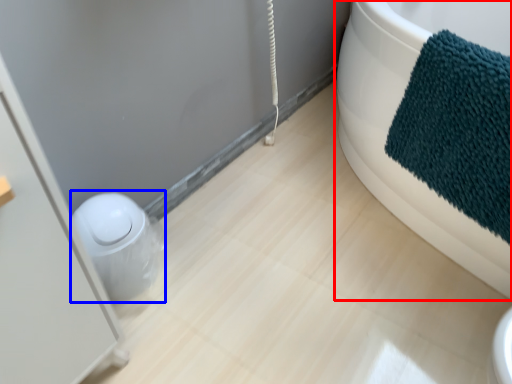
Question: Which object is further to the camera taking this photo, bathtub (highlighted by a red box) or toilet bowl (highlighted by a blue box)?

Choices:
 (A) bathtub
 (B) toilet bowl

Answer: (B)